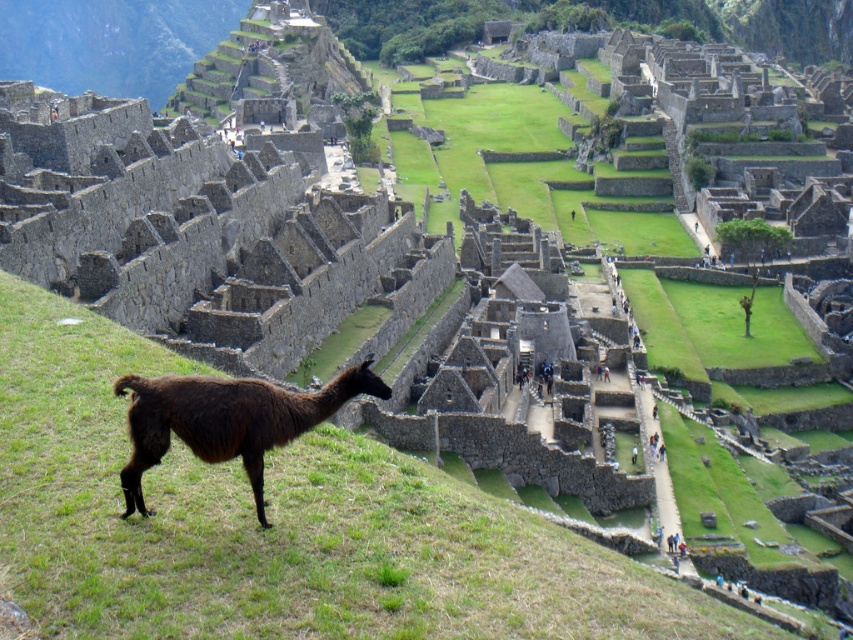
Question: Can you confirm if stone ruins at center is wider than brown woolly alpaca at lower left?

Choices:
 (A) no
 (B) yes

Answer: (B)

Question: Which of the following is the farthest from the observer?

Choices:
 (A) (106, 244)
 (B) (242, 445)

Answer: (A)

Question: Considering the relative positions of stone ruins at center and brown woolly alpaca at lower left in the image provided, where is stone ruins at center located with respect to brown woolly alpaca at lower left?

Choices:
 (A) below
 (B) above

Answer: (B)

Question: Which of the following is the closest to the observer?

Choices:
 (A) (241, 433)
 (B) (415, 230)

Answer: (A)

Question: Is stone ruins at center positioned before brown woolly alpaca at lower left?

Choices:
 (A) no
 (B) yes

Answer: (A)